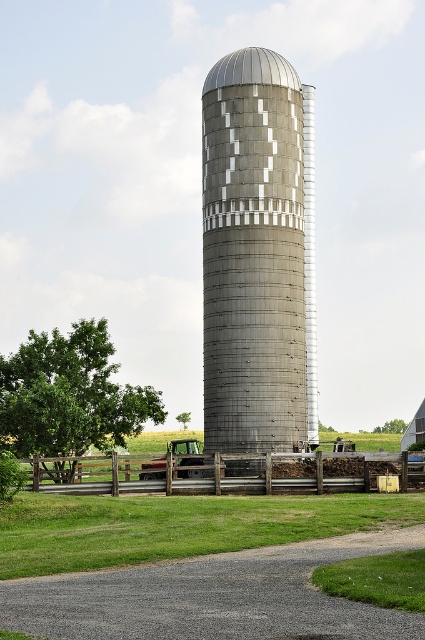
Question: Is gray metallic silo at center below wooden fence at lower center?

Choices:
 (A) yes
 (B) no

Answer: (B)

Question: Observing the image, what is the correct spatial positioning of gray metallic silo at center in reference to wooden fence at lower center?

Choices:
 (A) above
 (B) below

Answer: (A)

Question: Which point is closer to the camera?

Choices:
 (A) (235, 228)
 (B) (246, 492)

Answer: (B)

Question: Does gray metallic silo at center appear on the right side of wooden fence at lower center?

Choices:
 (A) yes
 (B) no

Answer: (B)

Question: Which point is farther from the camera taking this photo?

Choices:
 (A) click(257, 51)
 (B) click(410, 460)

Answer: (A)